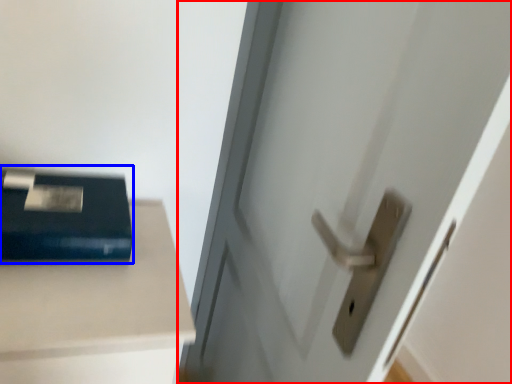
Question: Which object is closer to the camera taking this photo, door (highlighted by a red box) or paperback book (highlighted by a blue box)?

Choices:
 (A) door
 (B) paperback book

Answer: (A)